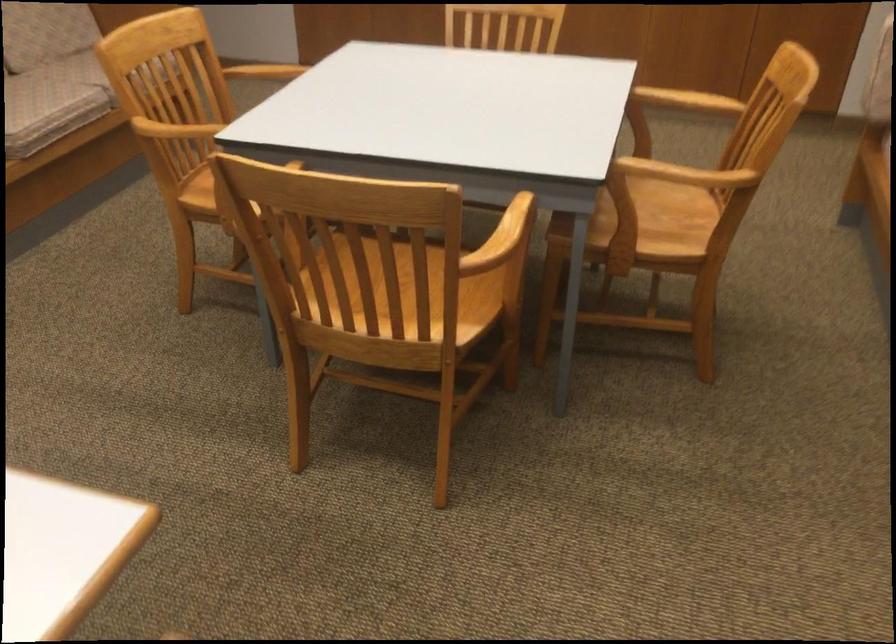
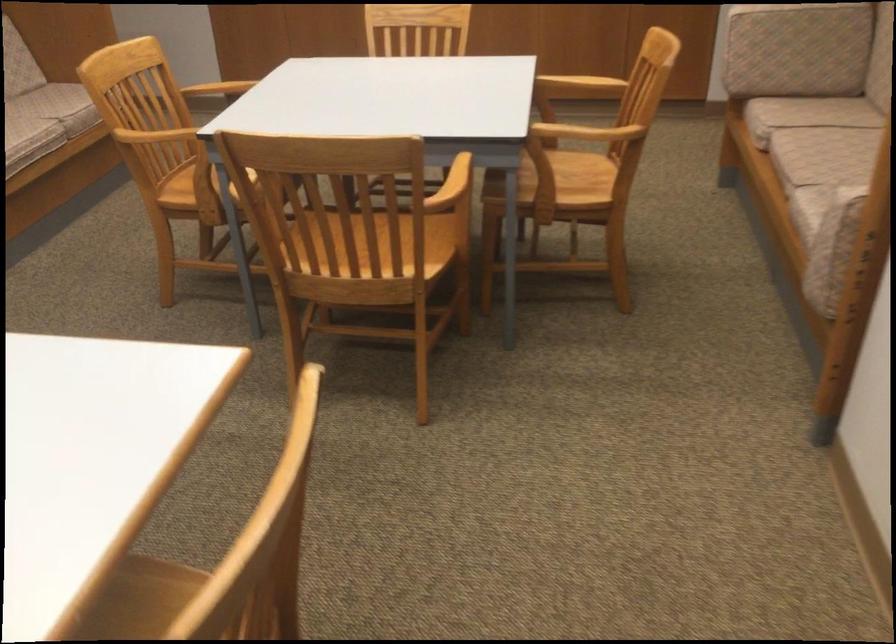
Locate, in the second image, the point that corresponds to (x=268, y=73) in the first image.

(218, 89)